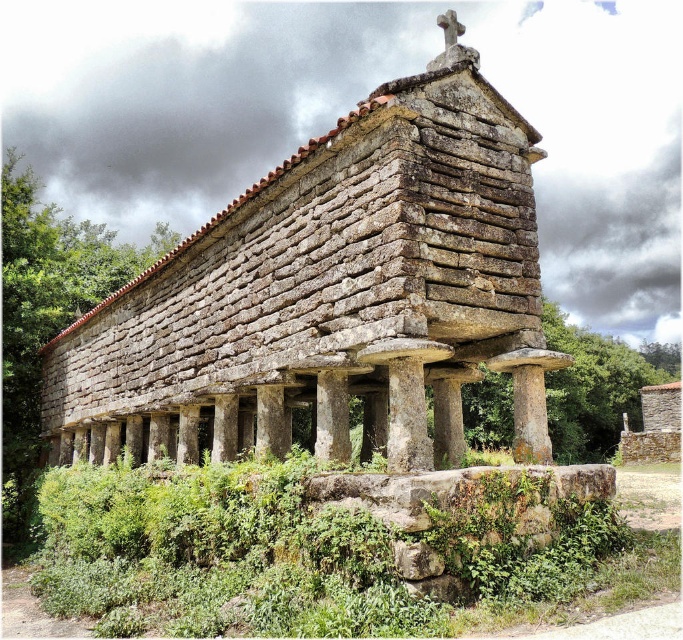
You are standing in front of the horreo and notice two points marked on the structure. The first point is at coordinates point (x=303, y=403) and the second is at point (x=270, y=387). Which of these points is closer to you?

Point (x=270, y=387) is closer to you because it is less further to the camera than point (x=303, y=403).

You are a farmer standing at the base of the green mossy stone at lower center and want to reach the brown stone hut at center. Which direction should you move to get there?

The brown stone hut at center is located above the green mossy stone at lower center, so you should move upward to reach it.